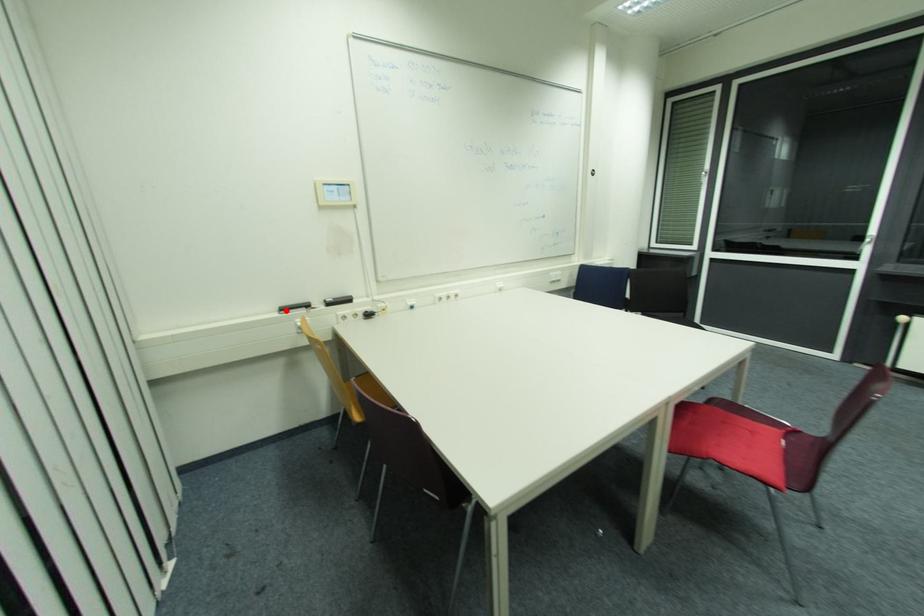
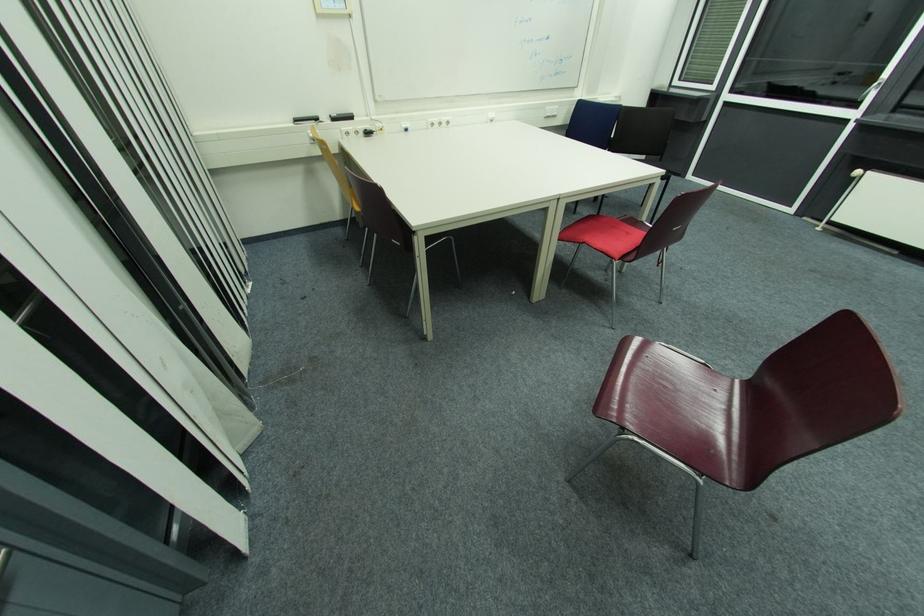
Where in the second image is the point corresponding to the highlighted location from the first image?

(300, 121)